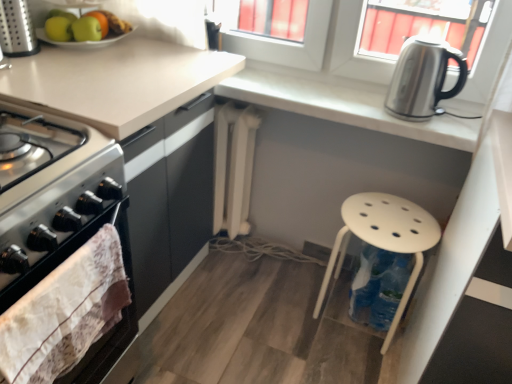
Locate an element on the screen. The height and width of the screenshot is (384, 512). vacant space in front of green matte apple at upper left, acting as the third apple starting from the right is located at coordinates (51, 56).